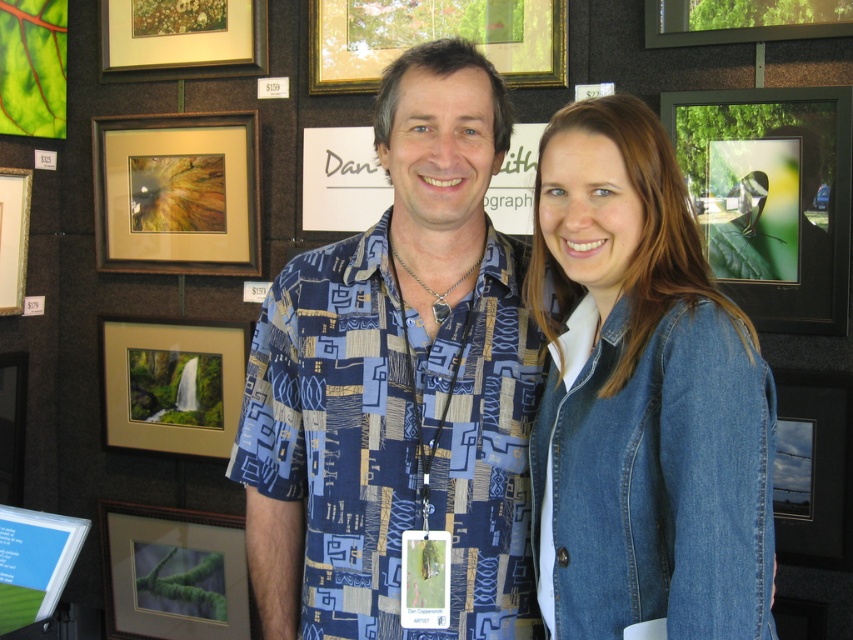
Is metallic silver frame at lower right shorter than metallic silver frame at upper right?

Incorrect, metallic silver frame at lower right's height does not fall short of metallic silver frame at upper right's.

Does metallic silver frame at lower right appear on the left side of metallic silver frame at upper right?

No, metallic silver frame at lower right is not to the left of metallic silver frame at upper right.

Between point (817, 502) and point (784, 419), which one is positioned behind?

Point (784, 419)

Image resolution: width=853 pixels, height=640 pixels. What are the coordinates of `metallic silver frame at lower right` in the screenshot? It's located at (813, 468).

Does wooden picture frame at upper center have a lesser height compared to metallic silver frame at upper right?

Indeed, wooden picture frame at upper center has a lesser height compared to metallic silver frame at upper right.

Find the location of a particular element. The width and height of the screenshot is (853, 640). wooden picture frame at upper center is located at coordinates (741, 20).

Between point (796, 35) and point (793, 497), which one is positioned behind?

The point (793, 497) is more distant.

Where is `wooden picture frame at upper center`? The image size is (853, 640). wooden picture frame at upper center is located at coordinates (741, 20).

Is point (457, 355) positioned before point (335, 65)?

Yes.

Is blue printed shirt at center bigger than gold-framed picture at upper center?

Yes, blue printed shirt at center is bigger than gold-framed picture at upper center.

The width and height of the screenshot is (853, 640). I want to click on blue printed shirt at center, so click(397, 385).